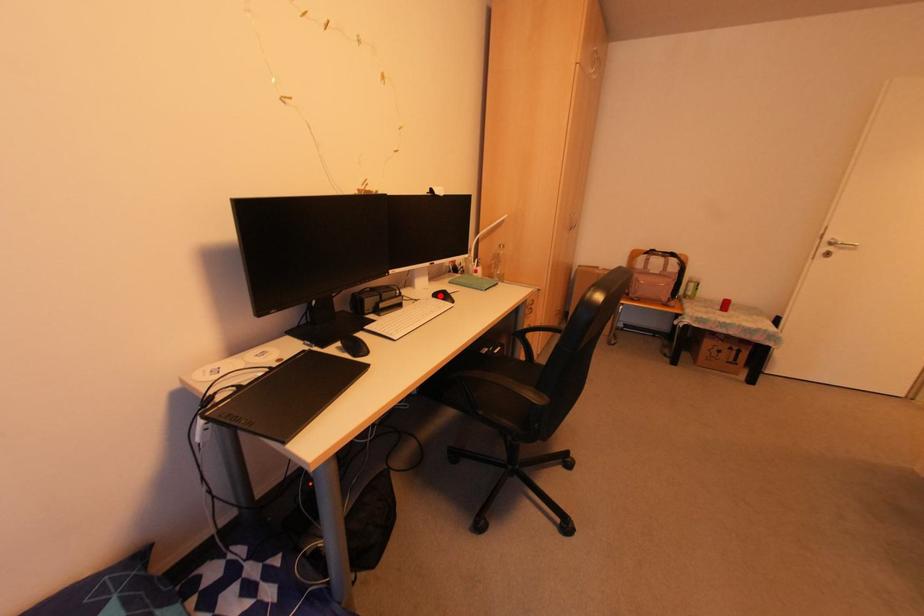
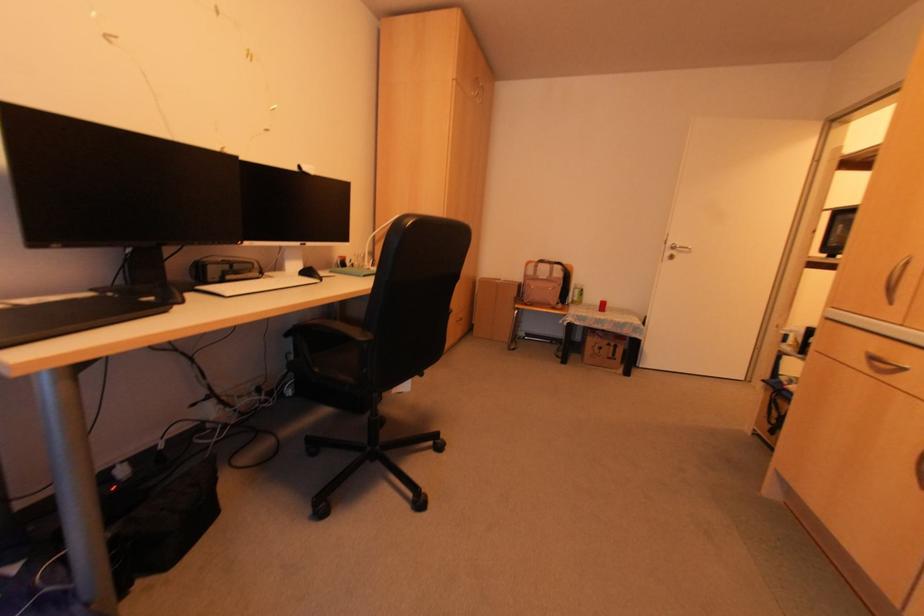
Where in the second image is the point corresponding to the highlighted location from the first image?

(305, 274)